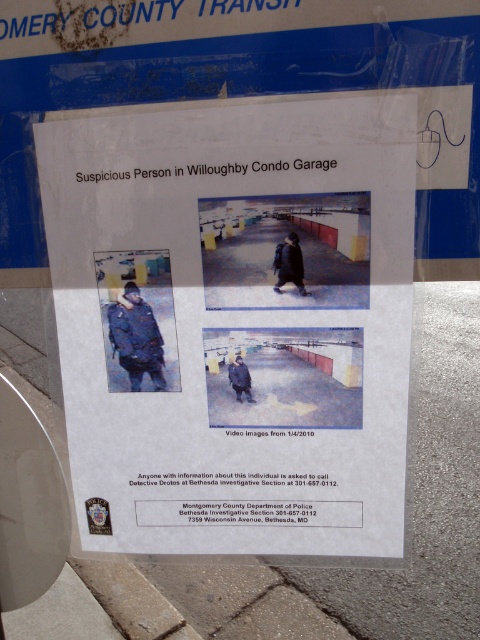
Is white paper at center in front of gray concrete pavement at lower center?

That is True.

Is point (104, 116) positioned behind point (394, 570)?

No, it is in front of (394, 570).

The width and height of the screenshot is (480, 640). Describe the element at coordinates (235, 323) in the screenshot. I see `white paper at center` at that location.

In order to click on white paper at center in this screenshot , I will do `click(235, 323)`.